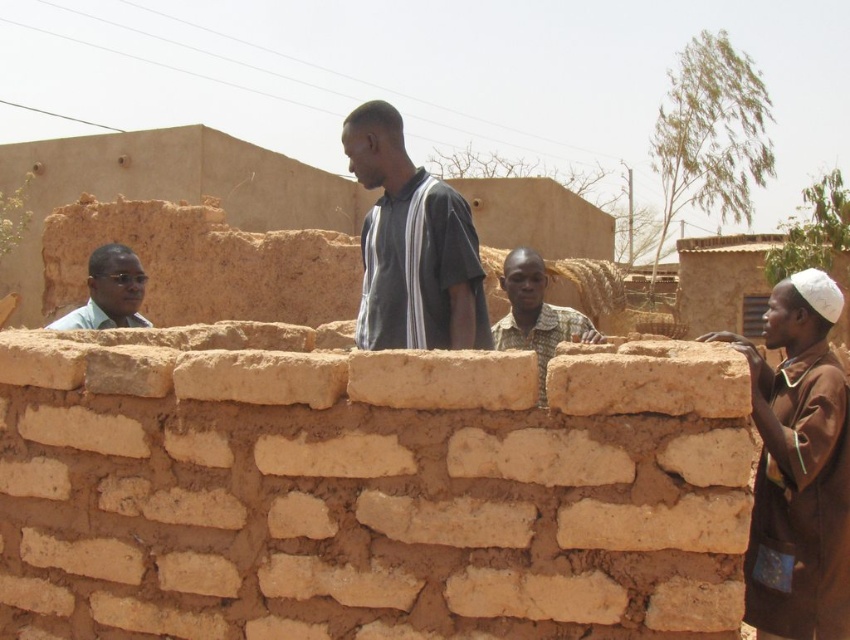
Question: Which object is farther from the camera taking this photo?

Choices:
 (A) patterned fabric shirt at center
 (B) dark gray striped shirt at center
 (C) brown mudbrick wall at center
 (D) brown clay brick at center

Answer: (A)

Question: Is the position of brown mudbrick wall at center less distant than that of dark gray striped shirt at center?

Choices:
 (A) no
 (B) yes

Answer: (B)

Question: Which is farther from the brown clay brick at center?

Choices:
 (A) brown cotton shirt at right
 (B) dark gray striped shirt at center
 (C) patterned fabric shirt at center
 (D) matte green shirt at upper left

Answer: (D)

Question: Can you confirm if brown mudbrick wall at center is positioned above brown clay brick at center?

Choices:
 (A) yes
 (B) no

Answer: (B)

Question: Can you confirm if brown mudbrick wall at center is positioned to the right of brown clay brick at center?

Choices:
 (A) no
 (B) yes

Answer: (A)

Question: Among these points, which one is farthest from the camera?

Choices:
 (A) (510, 259)
 (B) (136, 280)
 (C) (378, 234)
 (D) (616, 468)

Answer: (A)